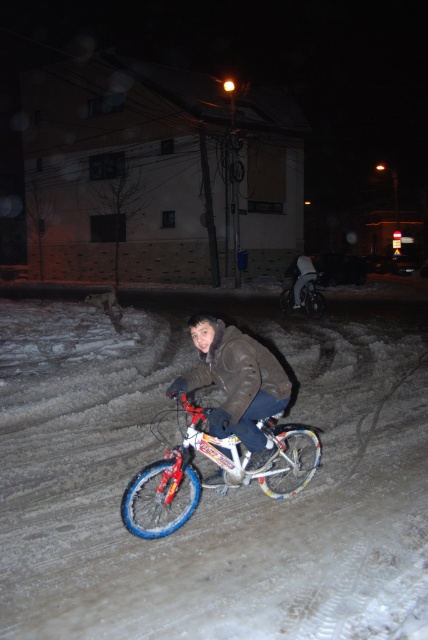
Does brown fuzzy jacket at center have a smaller size compared to metallic silver bicycle at center?

Actually, brown fuzzy jacket at center might be larger than metallic silver bicycle at center.

Who is lower down, brown fuzzy jacket at center or metallic silver bicycle at center?

brown fuzzy jacket at center

Find the location of `brown fuzzy jacket at center`. brown fuzzy jacket at center is located at coordinates (237, 384).

Does point (115, 476) come closer to viewer compared to point (158, 474)?

No, it is not.

Which is more to the right, white powdery snow at center or shiny metallic bicycle at center?

shiny metallic bicycle at center

This screenshot has width=428, height=640. What do you see at coordinates (208, 490) in the screenshot? I see `white powdery snow at center` at bounding box center [208, 490].

You are a GUI agent. You are given a task and a screenshot of the screen. Output one action in this format:
    pyautogui.click(x=<x>, y=<y>)
    Task: Click on the white powdery snow at center
    This screenshot has height=640, width=428.
    Given the screenshot: What is the action you would take?
    pyautogui.click(x=208, y=490)

Looking at this image, does metallic silver bicycle at center have a lesser height compared to matte black jacket at center?

Indeed, metallic silver bicycle at center has a lesser height compared to matte black jacket at center.

Is metallic silver bicycle at center to the left of matte black jacket at center from the viewer's perspective?

No, metallic silver bicycle at center is not to the left of matte black jacket at center.

From the picture: Who is more distant from viewer, [291,301] or [297,305]?

Point [291,301]

This screenshot has width=428, height=640. What are the coordinates of `metallic silver bicycle at center` in the screenshot? It's located at (312, 300).